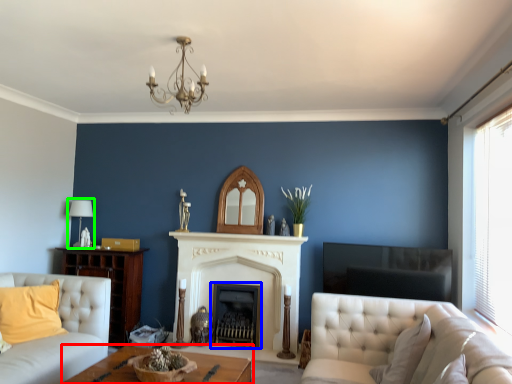
Question: Which object is positioned closest to table (highlighted by a red box)? Select from fireplace (highlighted by a blue box) and lamp (highlighted by a green box).

Choices:
 (A) fireplace
 (B) lamp

Answer: (A)